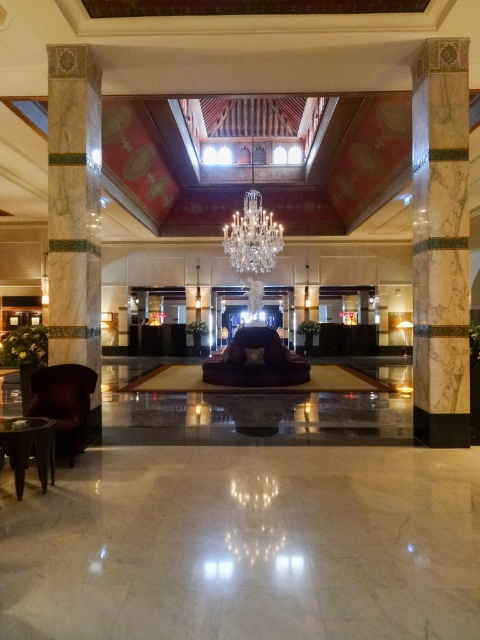
Does velvet purple armchair at center have a smaller size compared to crystal glass chandelier at center?

Correct, velvet purple armchair at center occupies less space than crystal glass chandelier at center.

Consider the image. Who is positioned more to the right, velvet purple armchair at center or crystal glass chandelier at center?

Positioned to the right is crystal glass chandelier at center.

This screenshot has height=640, width=480. Describe the element at coordinates (255, 362) in the screenshot. I see `velvet purple armchair at center` at that location.

The image size is (480, 640). I want to click on velvet purple armchair at center, so 255,362.

Is marble column at right bigger than velvet armchair at left?

Indeed, marble column at right has a larger size compared to velvet armchair at left.

Can you confirm if marble column at right is shorter than velvet armchair at left?

In fact, marble column at right may be taller than velvet armchair at left.

Measure the distance between point [445,241] and camera.

Point [445,241] and camera are 17.82 feet apart.

Identify the location of marble column at right. (441, 243).

Between point (85, 188) and point (220, 369), which one is positioned behind?

Point (220, 369)

Is marble column at left further to the viewer compared to velvet purple armchair at center?

No, it is in front of velvet purple armchair at center.

Measure the distance between point (50, 342) and camera.

A distance of 5.56 meters exists between point (50, 342) and camera.

Find the location of a particular element. Image resolution: width=480 pixels, height=640 pixels. marble column at left is located at coordinates (74, 214).